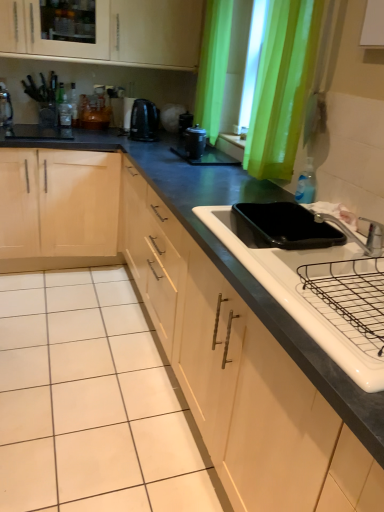
Question: From a real-world perspective, is black matte pizza pan at sink positioned above or below blue translucent bottle at sink right, the 1th bottle in the front-to-back sequence?

Choices:
 (A) below
 (B) above

Answer: (A)

Question: Based on their sizes in the image, would you say black matte pizza pan at sink is bigger or smaller than blue translucent bottle at sink right, the 1th bottle when ordered from bottom to top?

Choices:
 (A) big
 (B) small

Answer: (A)

Question: Considering the real-world distances, which object is farthest from the clear glass bottle at upper left, which is the first bottle in top-to-bottom order?

Choices:
 (A) brushed metal kettle at left
 (B) matte black coffee maker at center
 (C) silver metallic faucet at upper right
 (D) black glossy electric kettle at center
 (E) green fabric curtain at upper right

Answer: (C)

Question: Which is nearer to the silver metallic faucet at upper right?

Choices:
 (A) matte black coffee maker at center
 (B) white glossy sink at lower right
 (C) green fabric curtain at upper right
 (D) brushed metal kettle at left
 (E) black glossy electric kettle at center

Answer: (B)